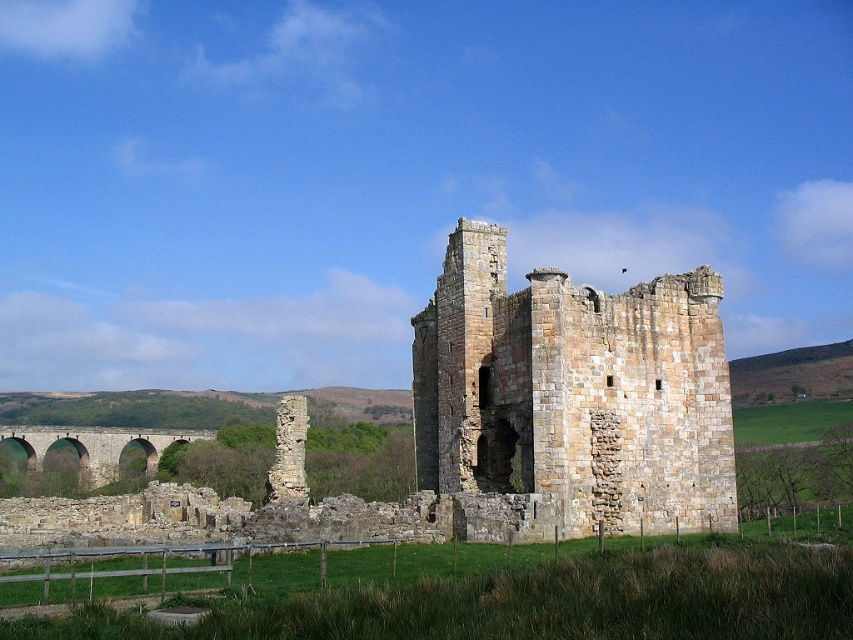
Between stone ruins at center and brown stone viaduct at lower left, which one has more height?

With more height is stone ruins at center.

Is point (450, 365) closer to camera compared to point (177, 440)?

Yes, point (450, 365) is in front of point (177, 440).

Which is behind, point (555, 358) or point (107, 465)?

Point (107, 465)

You are a GUI agent. You are given a task and a screenshot of the screen. Output one action in this format:
    pyautogui.click(x=<x>, y=<y>)
    Task: Click on the stone ruins at center
    This screenshot has height=640, width=853.
    Given the screenshot: What is the action you would take?
    pyautogui.click(x=572, y=397)